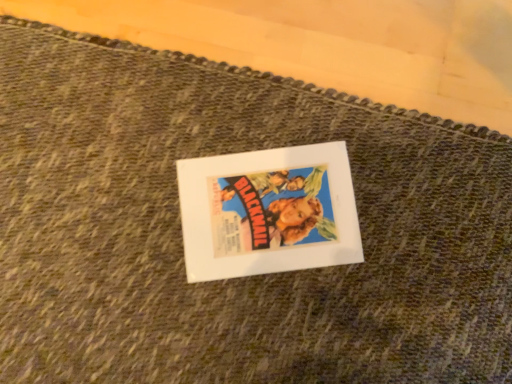
Image resolution: width=512 pixels, height=384 pixels. Find the location of `free space to the left of white paper at center`. free space to the left of white paper at center is located at coordinates [130, 230].